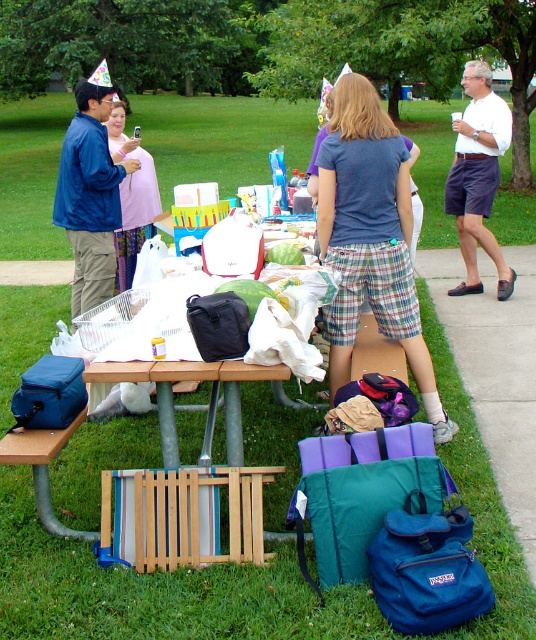
You are standing near the picnic table and want to greet the person wearing the blue cotton shirt at center and the person in the blue matte jacket at upper left. Which person will you approach first to shake hands?

You should approach the blue cotton shirt at center first because they are closer to you compared to the blue matte jacket at upper left, which is further away.

You are standing at the picnic table and want to grab your jacket without moving from your spot. Which object is closer to you, the blue matte jacket at upper left or the brushed metal park bench at lower left?

The blue matte jacket at upper left is closer to you since it is positioned to the left of the brushed metal park bench at lower left, which is further away.

You are organizing a small outdoor event and need to seat everyone comfortably. You have a limited space between the blue cotton shirt at center and the blue matte jacket at upper left. Based on their sizes, which one might require more space to accommodate?

The blue cotton shirt at center might require more space because it is wider than the blue matte jacket at upper left according to the description.